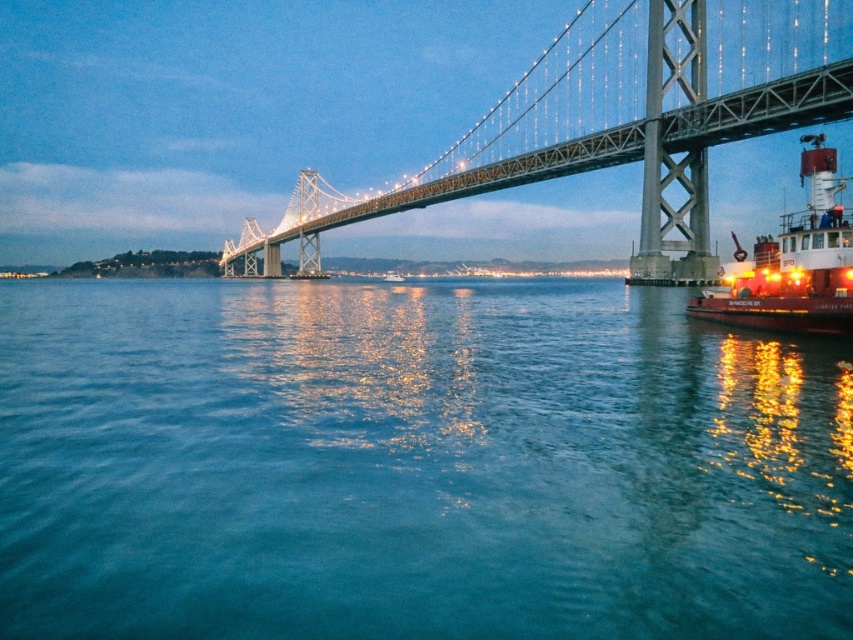
You are standing on the shore and see the blue water at center and the metallic gray suspension bridge at upper center. Which object is closer to your left side?

The blue water at center is to the left of the metallic gray suspension bridge at upper center, so it is closer to your left side.

You are a photographer planning to take a photo of the metallic gray suspension bridge at upper center and the red painted steel tugboat at right. Based on their positions, which object should appear higher in the photo?

The metallic gray suspension bridge at upper center should appear higher in the photo since it is positioned above the red painted steel tugboat at right according to their spatial arrangement.

You are standing at the camera position and want to throw a lifebuoy to someone in the blue water at center. The lifebuoy can travel 30 feet. Will it reach them?

The blue water at center is 33.67 feet from camera. Since the lifebuoy can only travel 30 feet, it will not reach the blue water at center.